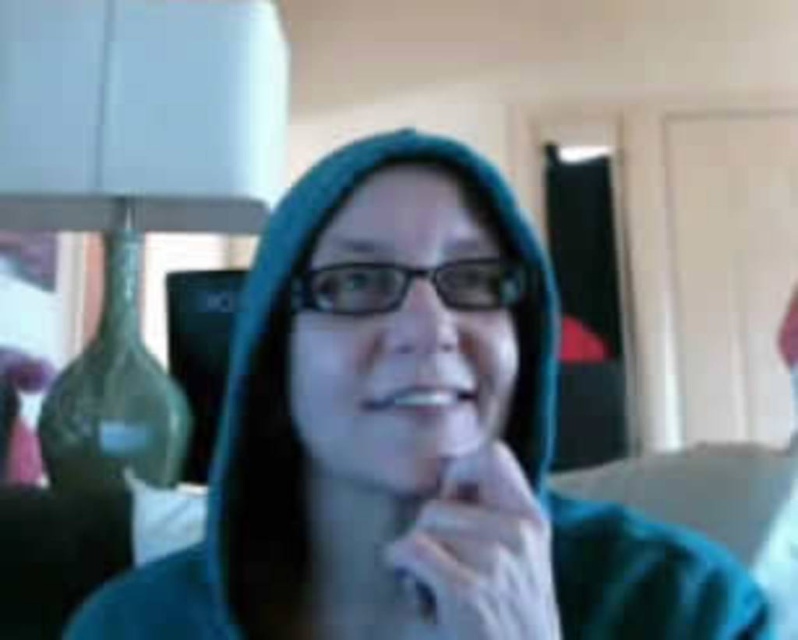
Question: Does white fabric hand at center appear on the right side of white glossy teeth at center?

Choices:
 (A) yes
 (B) no

Answer: (A)

Question: Based on their relative distances, which object is nearer to the teal fabric hoodie at center?

Choices:
 (A) white fabric hand at center
 (B) white glossy teeth at center

Answer: (A)

Question: Does teal fabric hoodie at center appear on the left side of white glossy teeth at center?

Choices:
 (A) yes
 (B) no

Answer: (A)

Question: Which of the following is the farthest from the observer?

Choices:
 (A) white fabric hand at center
 (B) teal fabric hoodie at center

Answer: (A)

Question: Is white fabric hand at center further to the viewer compared to white glossy teeth at center?

Choices:
 (A) yes
 (B) no

Answer: (B)

Question: Considering the real-world distances, which object is closest to the white fabric hand at center?

Choices:
 (A) white glossy teeth at center
 (B) teal fabric hoodie at center

Answer: (A)